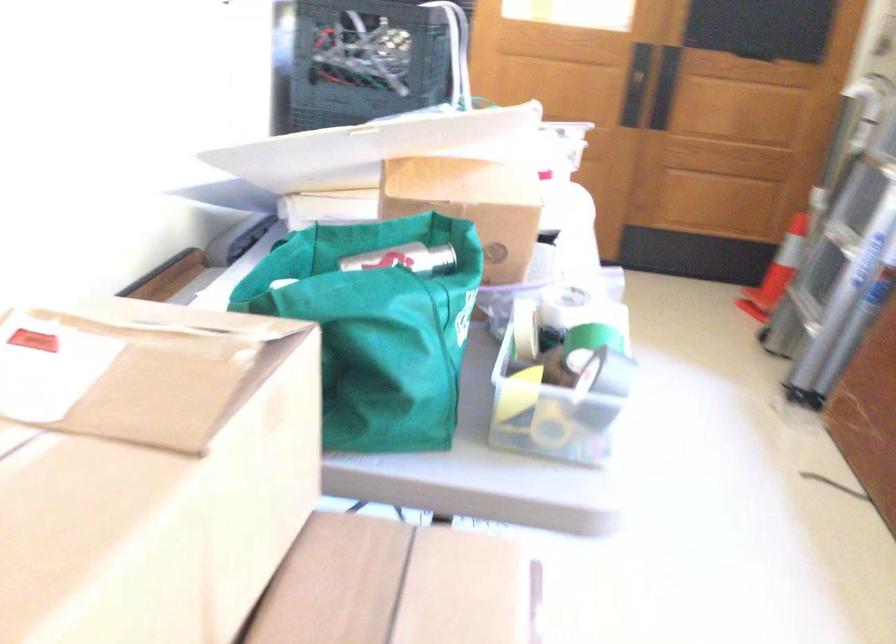
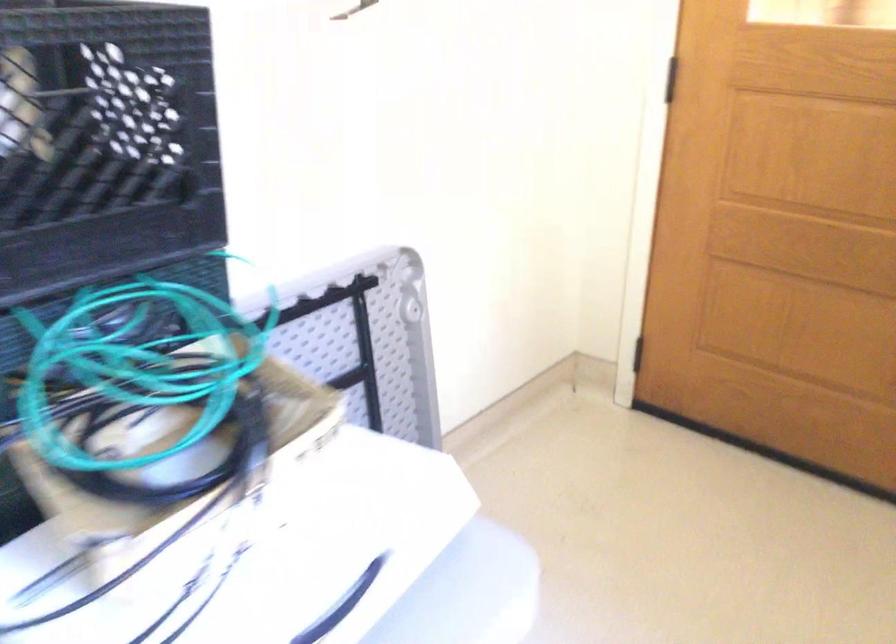
Which direction would the cameraman need to move to produce the second image?

The cameraman moved toward right, forward.